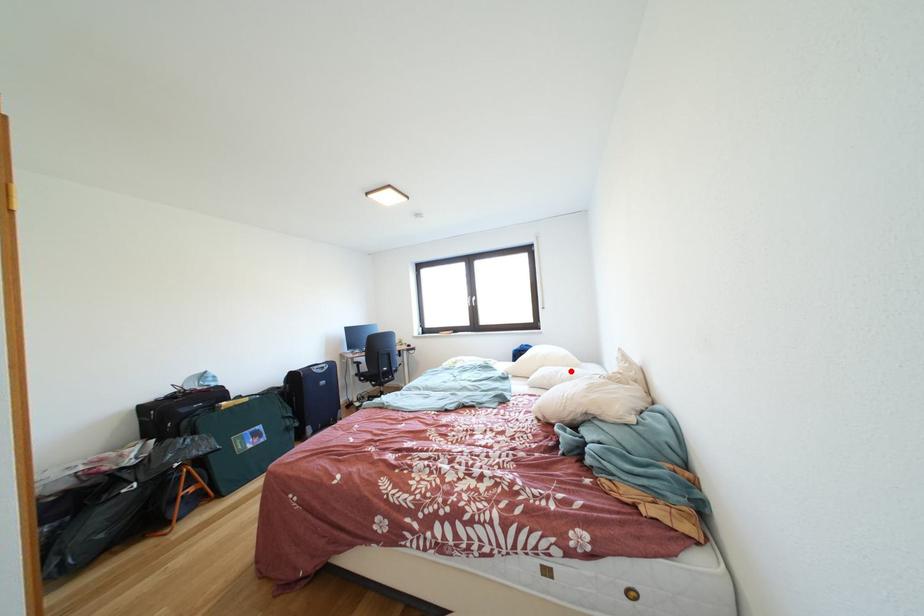
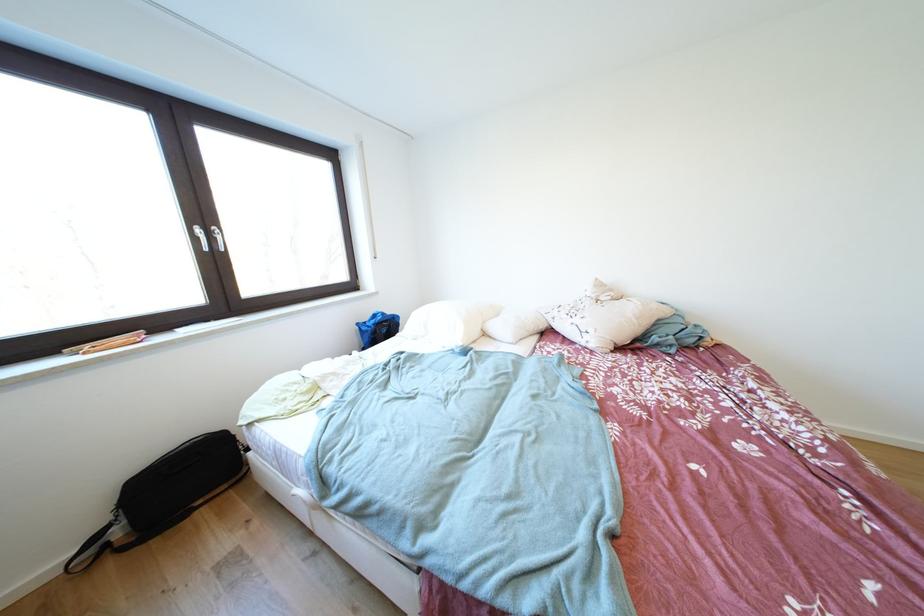
The point at the highlighted location is marked in the first image. Where is the corresponding point in the second image?

(505, 320)